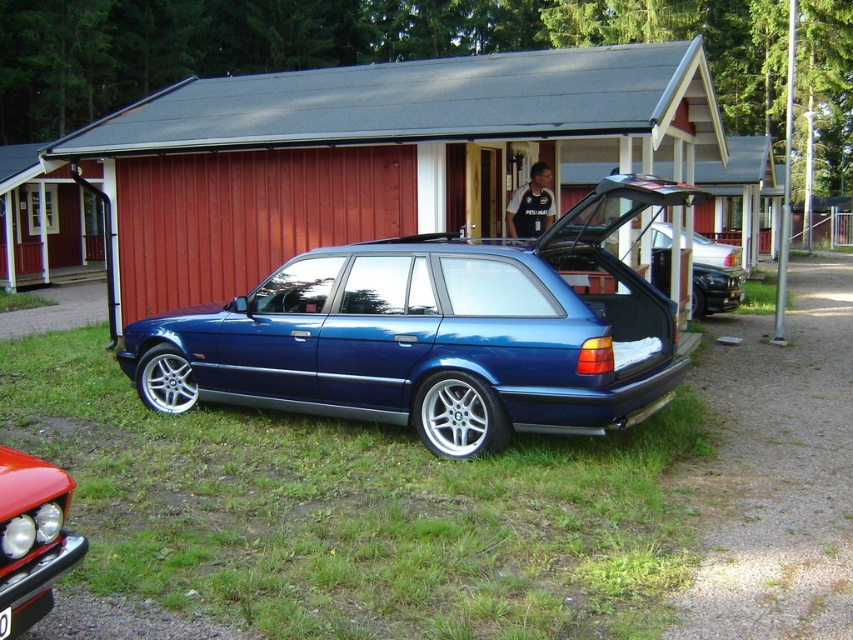
You are a delivery person trying to find the correct entrance to the shed. You see the wooden door at center and the black plastic license plate at center. Which object is located to the left of the other?

The wooden door at center is positioned on the left side of black plastic license plate at center.

You are a delivery person who needs to load a package into the back of the metallic blue wagon at center. The package is too large to fit through the standard opening. You notice the black plastic license plate at center. Can you remove the license plate to create more space for the package?

The metallic blue wagon at center is taller than the black plastic license plate at center. Since the wagon is taller, removing the license plate might provide additional vertical space to accommodate the package.